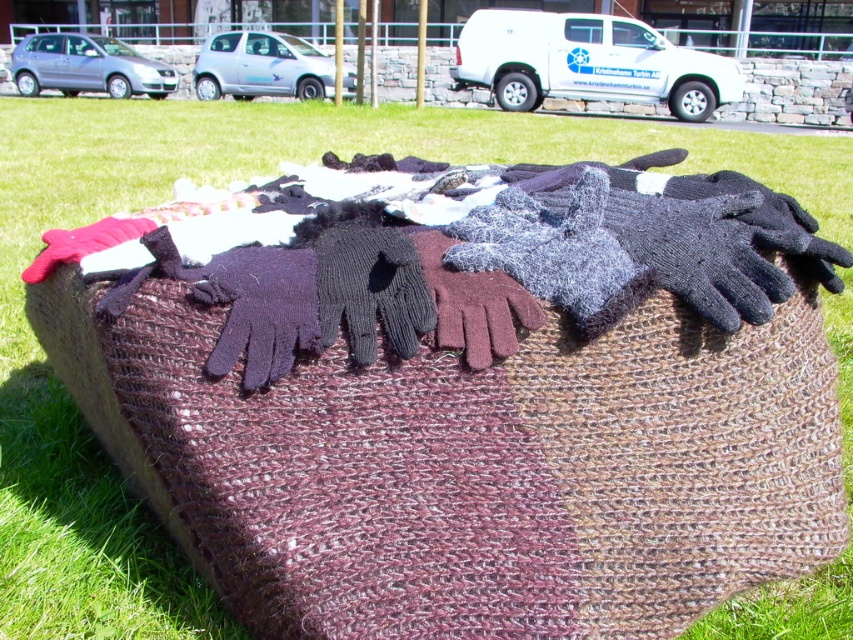
Describe the element at coordinates (555, 252) in the screenshot. I see `gray knitted gloves at center` at that location.

Identify the location of gray knitted gloves at center. (555, 252).